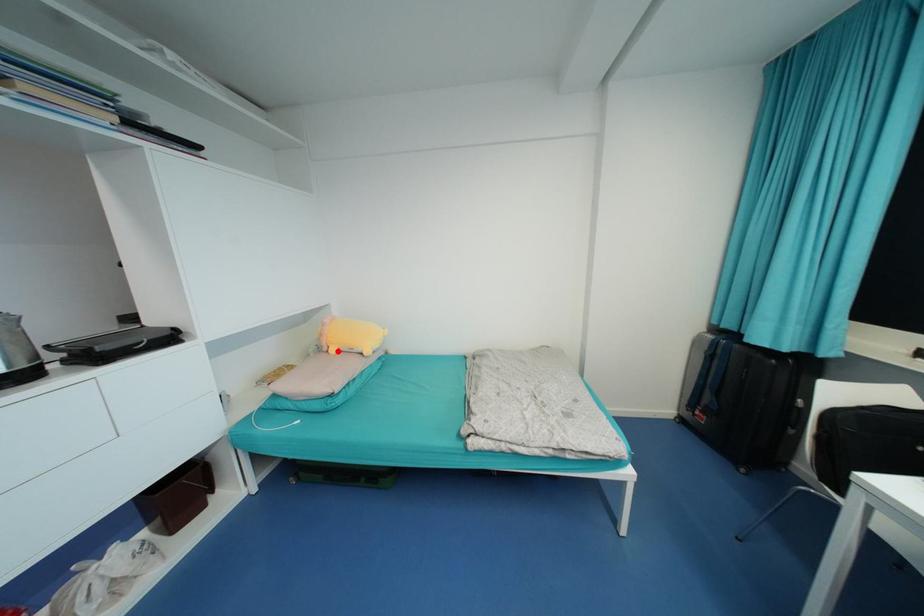
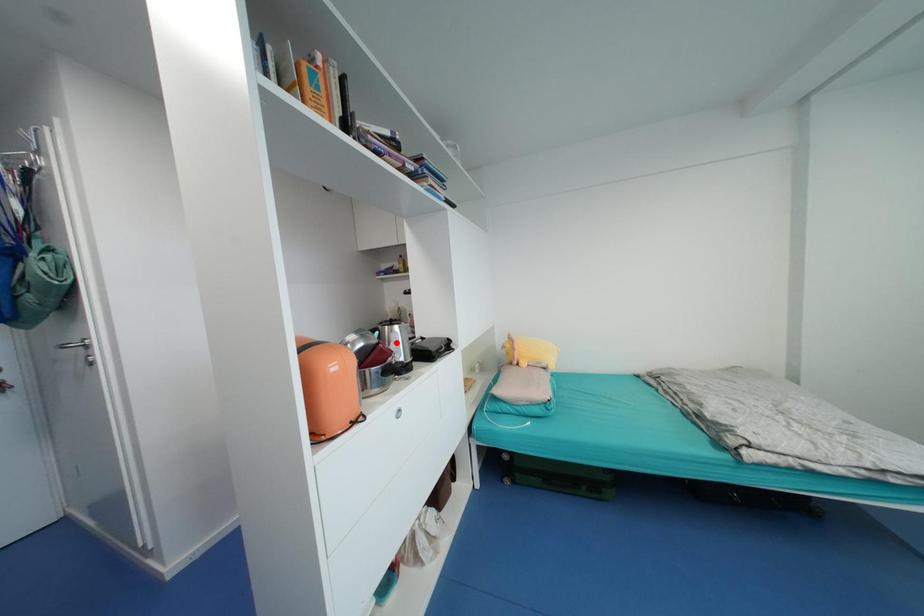
I am providing you with two images of the same scene from different viewpoints. A red point is marked on the first image and another point is marked on the second image. Does the point marked in image1 correspond to the same location as the one in image2?

No